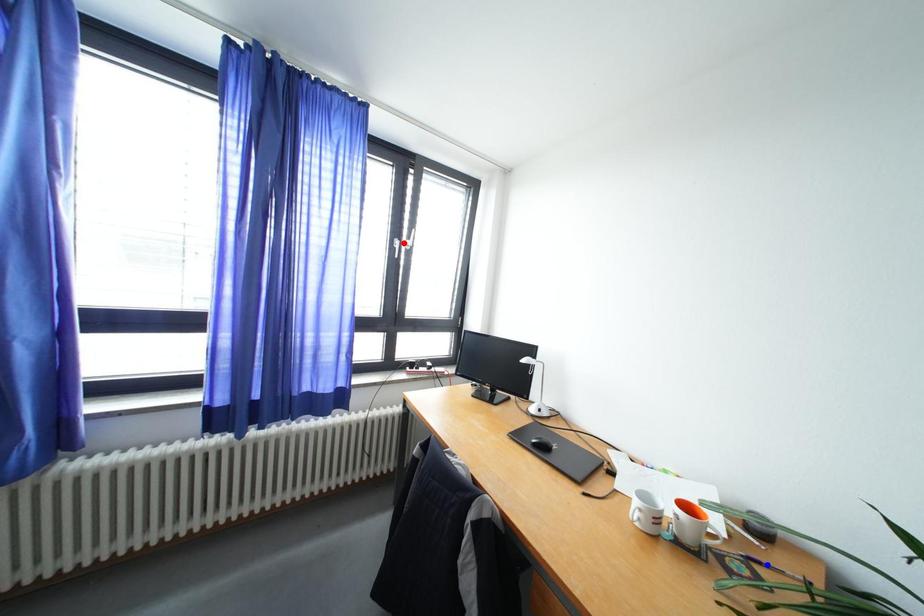
Question: In the image, two points are highlighted. Which point is nearer to the camera? Reply with the corresponding letter.

Choices:
 (A) blue point
 (B) red point

Answer: (A)